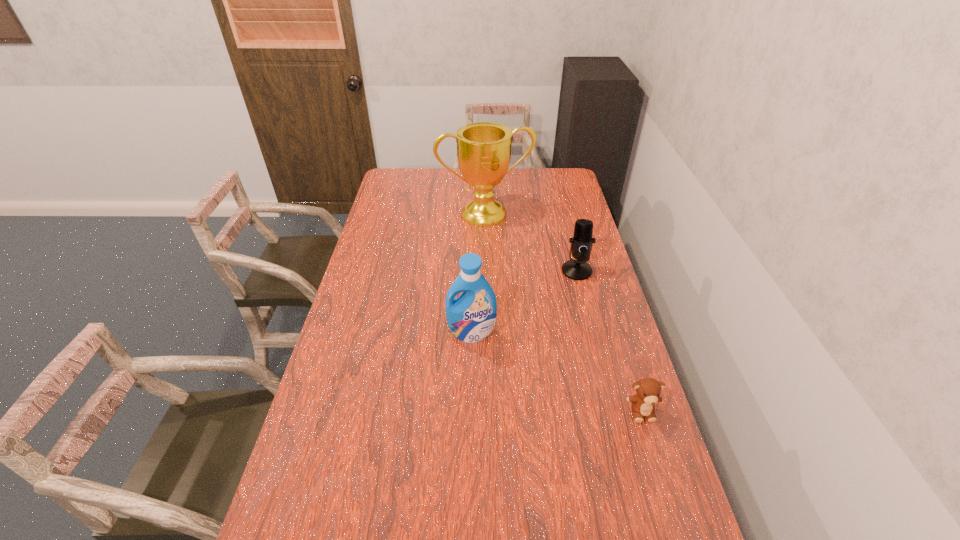
This screenshot has width=960, height=540. What are the coordinates of `free space at the left edge of the desktop` in the screenshot? It's located at (348, 390).

Image resolution: width=960 pixels, height=540 pixels. Find the location of `vacant point at the right edge`. vacant point at the right edge is located at coordinates (599, 429).

Image resolution: width=960 pixels, height=540 pixels. Identify the location of blank area at the near left corner. pyautogui.click(x=347, y=525).

In the image, there is a desktop. Identify the location of free region at the far right corner. (569, 179).

The width and height of the screenshot is (960, 540). In order to click on vacant area that lies between the nearest object and the third nearest object in this screenshot , I will do `click(610, 341)`.

The height and width of the screenshot is (540, 960). Identify the location of vacant space that's between the award and the nearest object. (564, 313).

The image size is (960, 540). Identify the location of free spot between the third farthest object and the second farthest object. (524, 302).

Where is `free space between the nearest object and the third shortest object`? free space between the nearest object and the third shortest object is located at coordinates (x=557, y=372).

Find the location of `free space that is in between the nearest object and the second farthest object`. free space that is in between the nearest object and the second farthest object is located at coordinates (610, 341).

Image resolution: width=960 pixels, height=540 pixels. Identify the location of free space between the detergent and the nearest object. (557, 372).